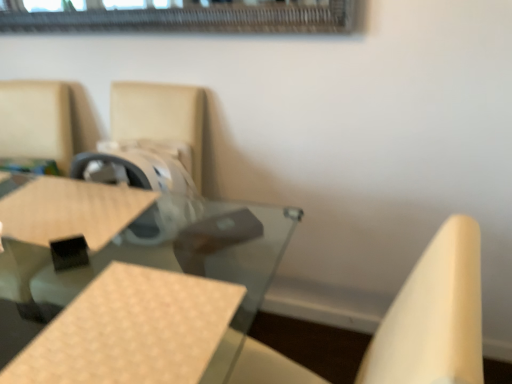
The width and height of the screenshot is (512, 384). I want to click on free space above beige woven plywood at center (from a real-world perspective), so click(128, 333).